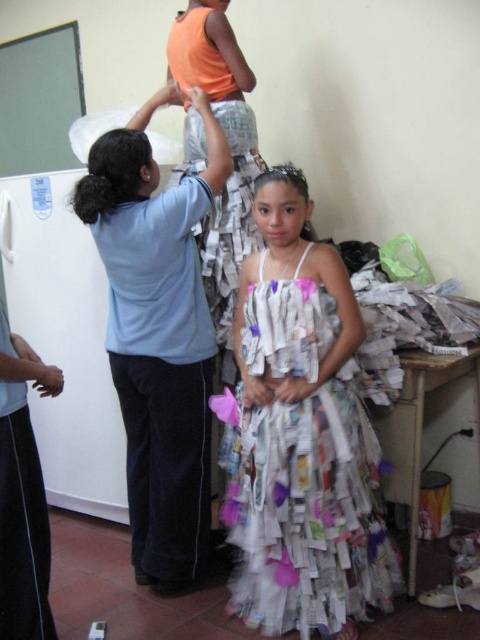
From the picture: Between recycled paper dress at center and matte blue shirt at upper left, which one is positioned higher?

matte blue shirt at upper left is above.

Can you confirm if recycled paper dress at center is smaller than matte blue shirt at upper left?

Correct, recycled paper dress at center occupies less space than matte blue shirt at upper left.

What do you see at coordinates (301, 435) in the screenshot?
I see `recycled paper dress at center` at bounding box center [301, 435].

At what (x,y) coordinates should I click in order to perform the action: click on recycled paper dress at center. Please return your answer as a coordinate pair (x, y). This screenshot has width=480, height=640. Looking at the image, I should click on (301, 435).